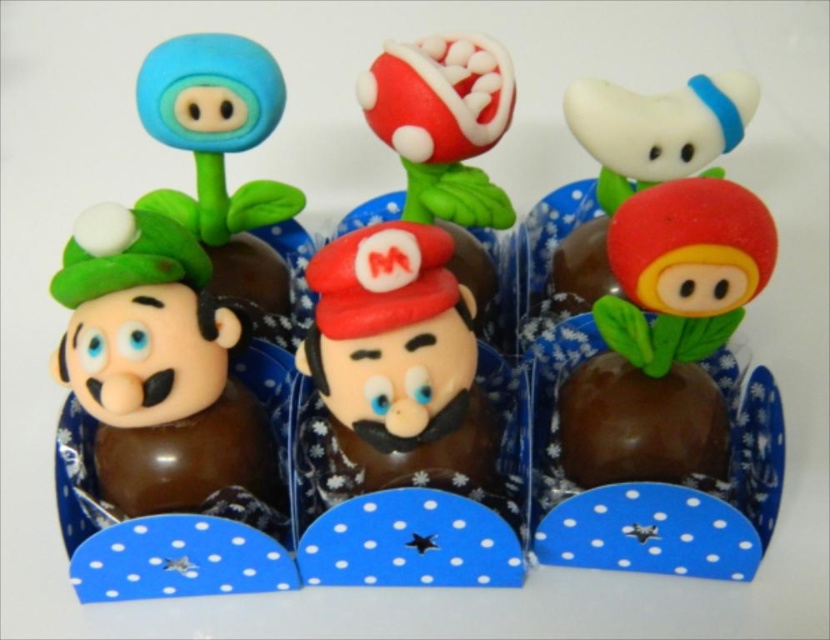
Question: Which of the following is the closest to the observer?

Choices:
 (A) (181, 492)
 (B) (603, 396)

Answer: (A)

Question: Does matte chocolate luigi at left appear under matte chocolate mushroom at center?

Choices:
 (A) yes
 (B) no

Answer: (A)

Question: Is the position of matte chocolate mushroom at center less distant than that of shiny chocolate mushroom at center?

Choices:
 (A) yes
 (B) no

Answer: (A)

Question: Estimate the real-world distances between objects in this image. Which object is farther from the matte chocolate luigi at left?

Choices:
 (A) white matte mushroom at center
 (B) matte chocolate mushroom at center
 (C) matte chocolate figurine at center

Answer: (A)

Question: Does matte chocolate figurine at center have a smaller size compared to white matte mushroom at center?

Choices:
 (A) no
 (B) yes

Answer: (B)

Question: Which point appears closest to the camera in this image?

Choices:
 (A) (204, 205)
 (B) (321, 477)
 (C) (579, 371)
 (D) (140, 422)

Answer: (D)